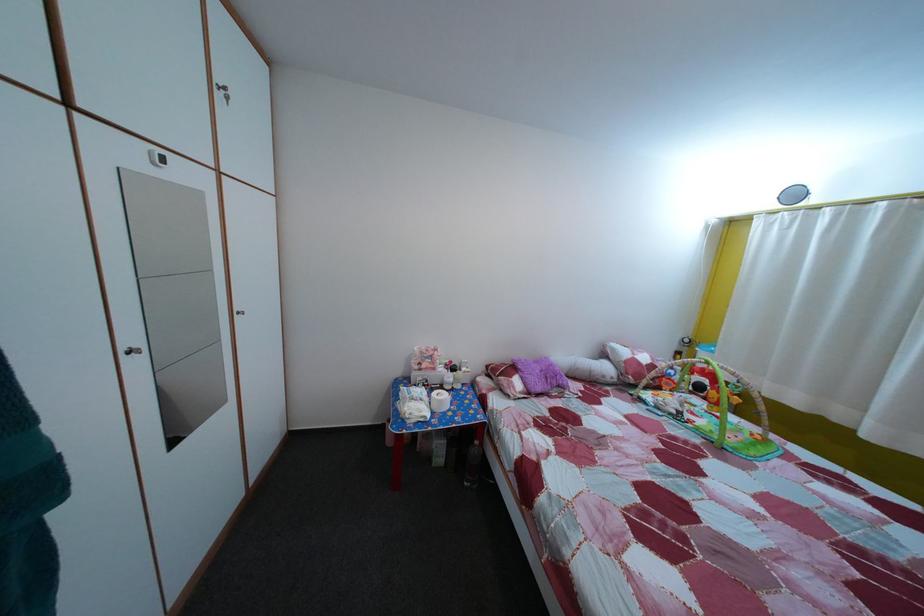
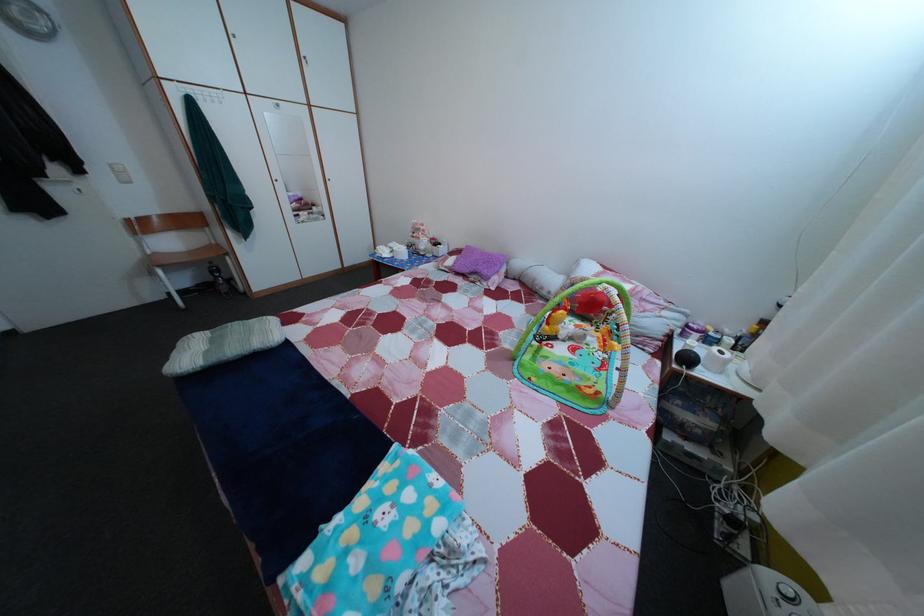
Find the pixel in the second image that matches [618,387] in the first image.

(553, 301)